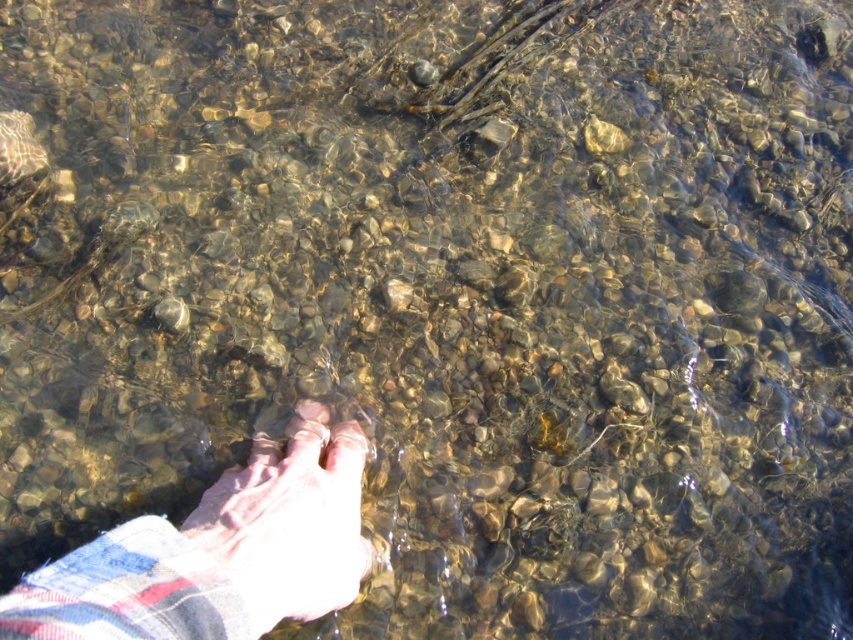
Is point (245, 525) farther from viewer compared to point (343, 424)?

No, (245, 525) is in front of (343, 424).

Is pink fabric foot at center closer to camera compared to pink flesh at center?

Yes.

Which is behind, point (310, 560) or point (338, 422)?

The point (338, 422) is behind.

What are the coordinates of `pink fabric foot at center` in the screenshot? It's located at (289, 522).

Is point (305, 552) positioned before point (345, 456)?

That is True.

From the picture: Measure the distance between plaid fabric hand at lower left and camera.

A distance of 24.13 inches exists between plaid fabric hand at lower left and camera.

Identify the location of plaid fabric hand at lower left. The width and height of the screenshot is (853, 640). (212, 557).

Is plaid fabric hand at lower left behind pink fabric foot at center?

No.

Does plaid fabric hand at lower left have a greater width compared to pink fabric foot at center?

Correct, the width of plaid fabric hand at lower left exceeds that of pink fabric foot at center.

Is point (286, 548) in front of point (292, 522)?

That is True.

At what (x,y) coordinates should I click in order to perform the action: click on plaid fabric hand at lower left. Please return your answer as a coordinate pair (x, y). The image size is (853, 640). Looking at the image, I should click on (212, 557).